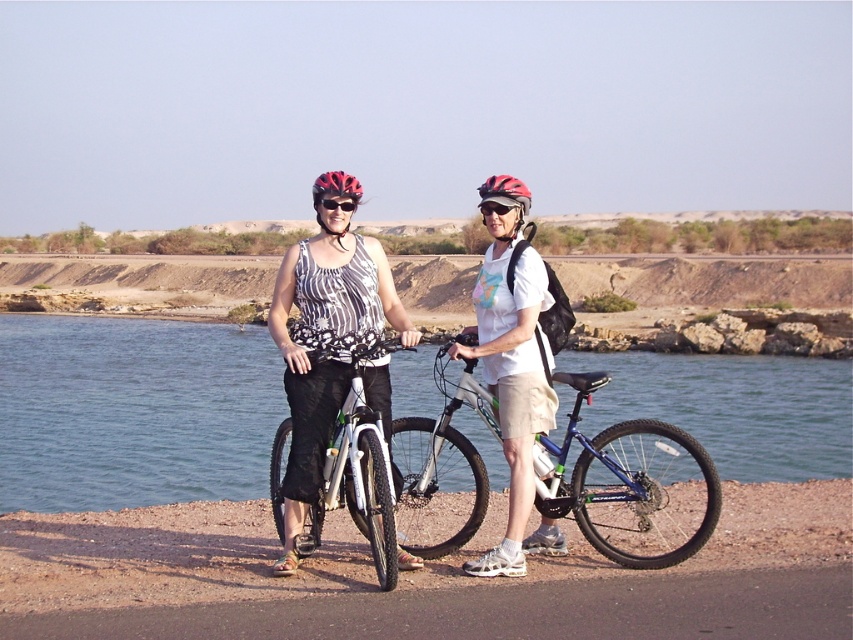
Is point (515, 205) closer to viewer compared to point (328, 208)?

No, (515, 205) is further to viewer.

Does point (525, 202) lie in front of point (326, 205)?

No, (525, 202) is behind (326, 205).

The height and width of the screenshot is (640, 853). I want to click on matte black helmet at center, so click(x=505, y=193).

Measure the distance between blue metallic bicycle at center and white matte mountain bike at center.

A distance of 10.95 feet exists between blue metallic bicycle at center and white matte mountain bike at center.

Is blue metallic bicycle at center smaller than white matte mountain bike at center?

No, blue metallic bicycle at center is not smaller than white matte mountain bike at center.

Does point (651, 545) come behind point (312, 528)?

Yes.

Where is `blue metallic bicycle at center`? This screenshot has width=853, height=640. blue metallic bicycle at center is located at coordinates (631, 484).

Who is taller, blue metallic bicycle at center or white matte shirt at center?

white matte shirt at center is taller.

Can you confirm if blue metallic bicycle at center is wider than white matte shirt at center?

Yes, blue metallic bicycle at center is wider than white matte shirt at center.

Who is more forward, (x=610, y=556) or (x=503, y=248)?

Positioned in front is point (x=503, y=248).

Identify the location of blue metallic bicycle at center. The width and height of the screenshot is (853, 640). (631, 484).